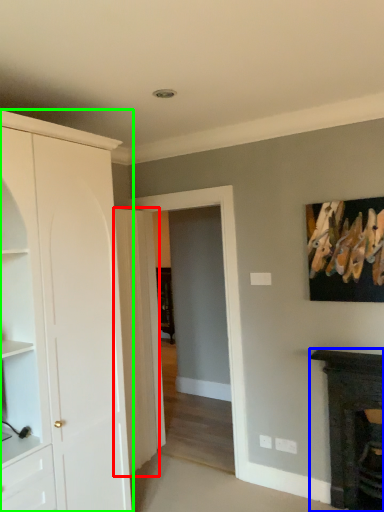
Question: Based on their relative distances, which object is farther from door (highlighted by a red box)? Choose from fireplace (highlighted by a blue box) and cabinetry (highlighted by a green box).

Choices:
 (A) fireplace
 (B) cabinetry

Answer: (A)